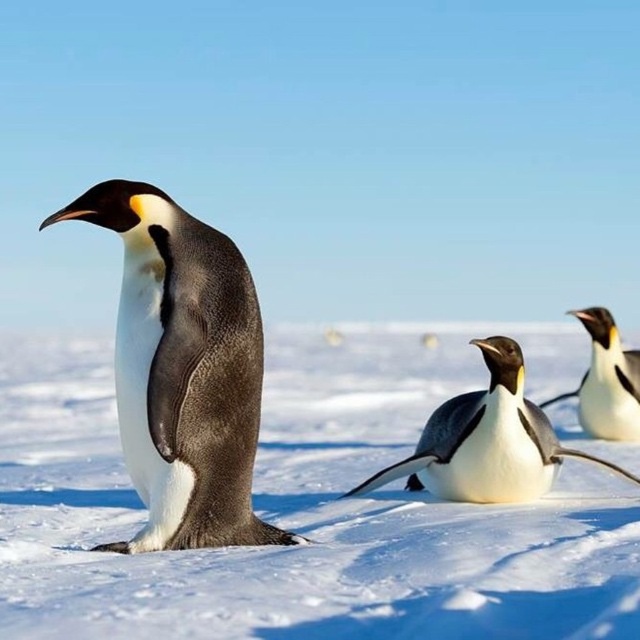
Between white fluffy snow at center and black glossy penguin at center, which one is positioned higher?

black glossy penguin at center

Is white fluffy snow at center thinner than black glossy penguin at center?

In fact, white fluffy snow at center might be wider than black glossy penguin at center.

Find the location of `white fluffy snow at center`. white fluffy snow at center is located at coordinates point(300,513).

Does white fluffy snow at center have a lesser width compared to black matte penguin at center?

No.

Does white fluffy snow at center have a greater width compared to black matte penguin at center?

Indeed, white fluffy snow at center has a greater width compared to black matte penguin at center.

The height and width of the screenshot is (640, 640). Find the location of `white fluffy snow at center`. white fluffy snow at center is located at coordinates (300, 513).

Image resolution: width=640 pixels, height=640 pixels. I want to click on white fluffy snow at center, so click(300, 513).

Which of these two, black matte penguin at center or white glossy penguin at center, stands taller?

With more height is black matte penguin at center.

This screenshot has height=640, width=640. Find the location of `black matte penguin at center`. black matte penguin at center is located at coordinates (182, 371).